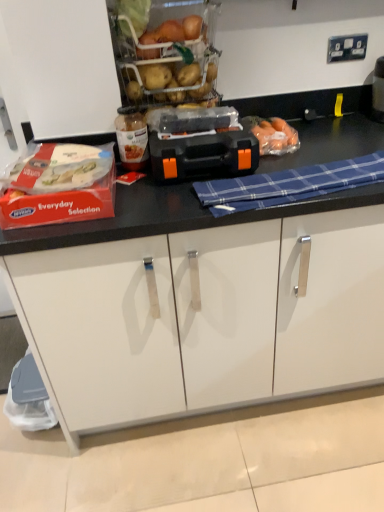
Find the location of a particular element. white plastic food at left, which is the first food from front to back is located at coordinates (58, 168).

Find the location of a particular element. The image size is (384, 512). black plastic toolbox at center is located at coordinates (200, 144).

The image size is (384, 512). In order to click on translucent plastic carrots at center, acting as the 2th food starting from the left in this screenshot , I will do `click(275, 137)`.

Describe the element at coordinates (288, 185) in the screenshot. The height and width of the screenshot is (512, 384). I see `blue plaid cloth at center` at that location.

Identify the location of translucent glass jar at center. (132, 140).

Between translucent plastic carrots at center, the 2th food from the front, and blue plaid cloth at center, which one has less height?

Standing shorter between the two is blue plaid cloth at center.

From the image's perspective, is translucent plastic carrots at center, which is the first food in back-to-front order, under blue plaid cloth at center?

Incorrect, from the image's perspective, translucent plastic carrots at center, which is the first food in back-to-front order, is higher than blue plaid cloth at center.

Considering their positions, is translucent plastic carrots at center, acting as the 2th food starting from the left, located in front of or behind blue plaid cloth at center?

Visually, translucent plastic carrots at center, acting as the 2th food starting from the left, is located behind blue plaid cloth at center.

Is translucent glass jar at center a part of blue plaid cloth at center?

No.

Does blue plaid cloth at center have a lesser width compared to translucent glass jar at center?

In fact, blue plaid cloth at center might be wider than translucent glass jar at center.

Does blue plaid cloth at center touch translucent glass jar at center?

There is a gap between blue plaid cloth at center and translucent glass jar at center.

From the picture: Considering the relative positions of blue plaid cloth at center and translucent glass jar at center in the image provided, is blue plaid cloth at center to the left or to the right of translucent glass jar at center?

blue plaid cloth at center is positioned on translucent glass jar at center's right side.

Which is more to the right, white plastic food at left, which is the first food from front to back, or translucent glass jar at center?

From the viewer's perspective, translucent glass jar at center appears more on the right side.

Is white plastic food at left, the second food when ordered from back to front, far away from translucent glass jar at center?

No, white plastic food at left, the second food when ordered from back to front, is not far from translucent glass jar at center.

From a real-world perspective, is white plastic food at left, which appears as the 1th food when viewed from the left, beneath translucent glass jar at center?

Indeed, from a real-world perspective, white plastic food at left, which appears as the 1th food when viewed from the left, is positioned beneath translucent glass jar at center.

In terms of height, does white matte cabinet at lower center look taller or shorter compared to translucent glass jar at center?

Considering their sizes, white matte cabinet at lower center has less height than translucent glass jar at center.

Could you tell me if white matte cabinet at lower center is turned towards translucent glass jar at center?

No, white matte cabinet at lower center is not turned towards translucent glass jar at center.

At what (x,y) coordinates should I click in order to perform the action: click on cabinetry on the right side of translucent glass jar at center. Please return your answer as a coordinate pair (x, y). This screenshot has height=512, width=384. Looking at the image, I should click on (203, 318).

Looking at this image, which of these two, black plastic toolbox at center or translucent plastic carrots at center, which is the first food in back-to-front order, stands shorter?

With less height is translucent plastic carrots at center, which is the first food in back-to-front order.

Which is closer to the camera, (186, 175) or (284, 138)?

Point (186, 175)

Where is `appliance that is above the translucent plastic carrots at center, acting as the 2th food starting from the left (from a real-world perspective)`? The width and height of the screenshot is (384, 512). appliance that is above the translucent plastic carrots at center, acting as the 2th food starting from the left (from a real-world perspective) is located at coordinates pos(200,144).

How many degrees apart are the facing directions of black plastic toolbox at center and translucent plastic carrots at center, the 2th food from the front?

They differ by 0.00077 degrees in their facing directions.

Locate an element on the screen. The height and width of the screenshot is (512, 384). cabinetry behind the blue plaid cloth at center is located at coordinates (203, 318).

Which is correct: blue plaid cloth at center is inside white matte cabinet at lower center, or outside of it?

blue plaid cloth at center is located beyond the bounds of white matte cabinet at lower center.

Which object is positioned more to the right, blue plaid cloth at center or white matte cabinet at lower center?

blue plaid cloth at center is more to the right.

Which of these two, blue plaid cloth at center or white matte cabinet at lower center, is bigger?

With larger size is white matte cabinet at lower center.

Do you think translucent glass jar at center is within white plastic food at left, which appears as the 1th food when viewed from the left, or outside of it?

translucent glass jar at center is not enclosed by white plastic food at left, which appears as the 1th food when viewed from the left.

Does point (130, 126) come closer to viewer compared to point (96, 174)?

That is False.

Considering the positions of objects translucent glass jar at center and white plastic food at left, which appears as the 1th food when viewed from the left, in the image provided, who is more to the right, translucent glass jar at center or white plastic food at left, which appears as the 1th food when viewed from the left,?

Positioned to the right is translucent glass jar at center.

From a real-world perspective, starting from the blue plaid cloth at center, which food is the 1st one vertically above it? Please provide its 2D coordinates.

[(275, 137)]

Identify the location of blanket located underneath the translucent glass jar at center (from a real-world perspective). (288, 185).

Looking at the image, which one is located further to white matte cabinet at lower center, translucent glass jar at center or translucent plastic carrots at center, the 2th food from the front?

translucent plastic carrots at center, the 2th food from the front, lies further to white matte cabinet at lower center than the other object.

Looking at the image, which one is located further to white matte cabinet at lower center, translucent glass jar at center or black plastic toolbox at center?

Based on the image, translucent glass jar at center appears to be further to white matte cabinet at lower center.

Estimate the real-world distances between objects in this image. Which object is closer to white plastic food at left, which is the first food from front to back, blue plaid cloth at center or black plastic toolbox at center?

Based on the image, black plastic toolbox at center appears to be nearer to white plastic food at left, which is the first food from front to back.

Based on their spatial positions, is blue plaid cloth at center or white matte cabinet at lower center further from black plastic toolbox at center?

white matte cabinet at lower center.

From the image, which object appears to be farther from white plastic food at left, the second food from the right, translucent plastic carrots at center, which is the first food in back-to-front order, or black plastic toolbox at center?

Among the two, translucent plastic carrots at center, which is the first food in back-to-front order, is located further to white plastic food at left, the second food from the right.

Based on their spatial positions, is blue plaid cloth at center or white plastic food at left, which is the first food from front to back, closer to black plastic toolbox at center?

blue plaid cloth at center.

Based on the photo, estimate the real-world distances between objects in this image. Which object is further from translucent glass jar at center, translucent plastic carrots at center, acting as the 2th food starting from the left, or black plastic toolbox at center?

translucent plastic carrots at center, acting as the 2th food starting from the left.

Based on their spatial positions, is white matte cabinet at lower center or white plastic food at left, the second food from the right, further from black plastic toolbox at center?

white matte cabinet at lower center.

The height and width of the screenshot is (512, 384). I want to click on bottle between white plastic food at left, which appears as the 1th food when viewed from the left, and blue plaid cloth at center from left to right, so click(x=132, y=140).

Identify the location of food between translucent glass jar at center and blue plaid cloth at center. This screenshot has width=384, height=512. (275, 137).

Image resolution: width=384 pixels, height=512 pixels. Identify the location of appliance between translucent plastic carrots at center, acting as the 2th food starting from the left, and white matte cabinet at lower center vertically. (200, 144).

Locate an element on the screen. blanket between translucent plastic carrots at center, acting as the 2th food starting from the left, and white matte cabinet at lower center from top to bottom is located at coordinates (288, 185).